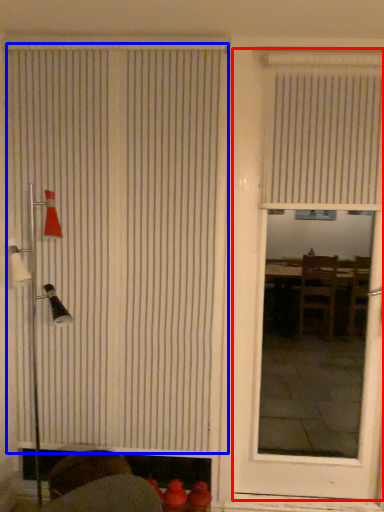
Question: Which point is closer to the camera, door (highlighted by a red box) or window blind (highlighted by a blue box)?

Choices:
 (A) door
 (B) window blind

Answer: (A)